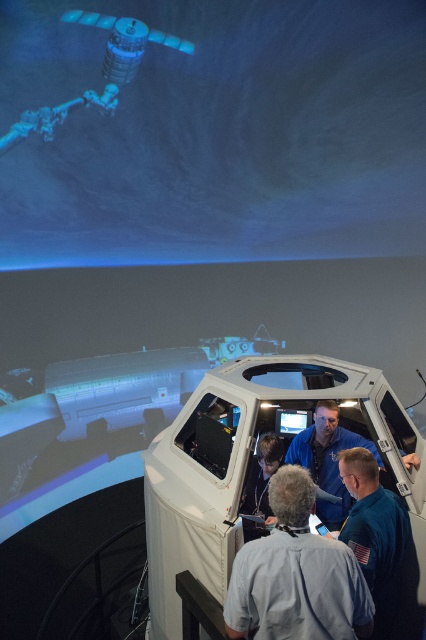
You are an astronaut preparing for a mission and notice two items in your locker. One is the blue uniform at center and the other is the blue fabric shirt at center. Which item is shorter in height?

The blue uniform at center is shorter in height compared to the blue fabric shirt at center.

You are an astronaut in training and need to locate your training equipment. You see a blue fabric astronaut at lower right and a matte black monitor at center. Which object is positioned to the right side of the other?

The blue fabric astronaut at lower right is positioned to the right of the matte black monitor at center.

In the scene shown: You are a visitor in the space simulation exhibit and want to take a photo of the blue fabric astronaut at lower right. Where should you stand to capture the astronaut in the best possible angle?

To capture the blue fabric astronaut at lower right in the best angle, you should position yourself near the lower right area of the exhibit, aligning your camera with the astronaut to ensure it is centered in your frame.